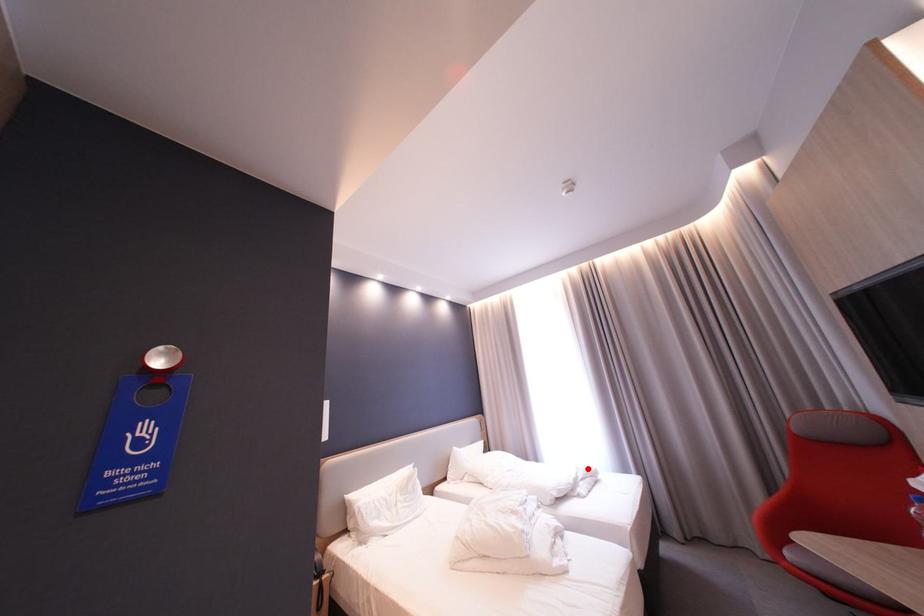
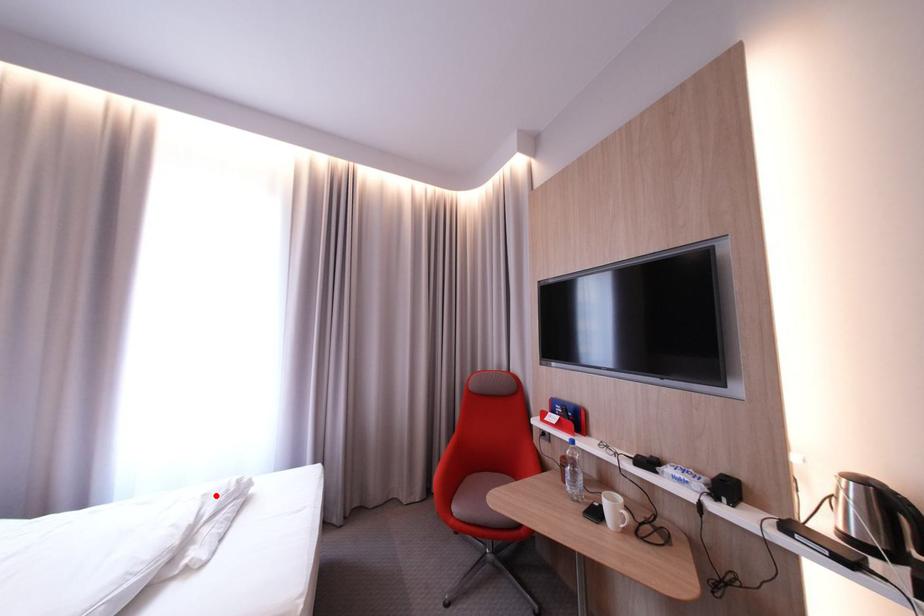
I am providing you with two images of the same scene from different viewpoints. A red point is marked on the first image and another point is marked on the second image. Does the point marked in image1 correspond to the same location as the one in image2?

Yes